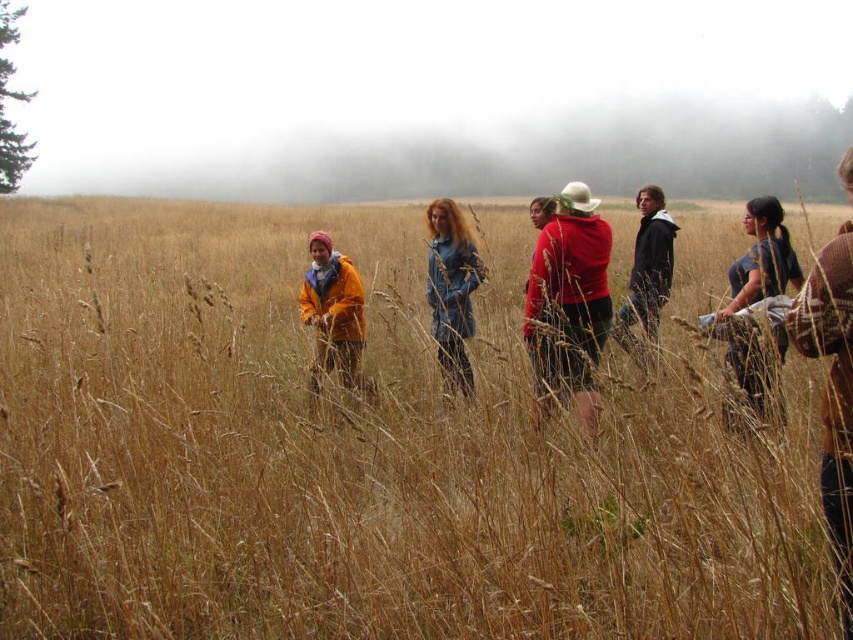
Question: Can you confirm if brown knitted hat at right is thinner than dark blue shirt at right?

Choices:
 (A) no
 (B) yes

Answer: (B)

Question: Is brown knitted hat at right wider than matte yellow jacket at center?

Choices:
 (A) no
 (B) yes

Answer: (B)

Question: Is red matte hoodie at center positioned before brown knitted hat at right?

Choices:
 (A) no
 (B) yes

Answer: (A)

Question: Among these objects, which one is nearest to the camera?

Choices:
 (A) brown knitted hat at right
 (B) dark gray hoodie at center
 (C) dark blue shirt at right
 (D) denim jacket at center

Answer: (A)

Question: Estimate the real-world distances between objects in this image. Which object is closer to the brown knitted hat at right?

Choices:
 (A) dark gray hoodie at center
 (B) matte yellow jacket at center

Answer: (A)

Question: Estimate the real-world distances between objects in this image. Which object is farther from the dark gray hoodie at center?

Choices:
 (A) denim jacket at center
 (B) dark blue shirt at right
 (C) matte yellow jacket at center
 (D) brown knitted hat at right

Answer: (D)